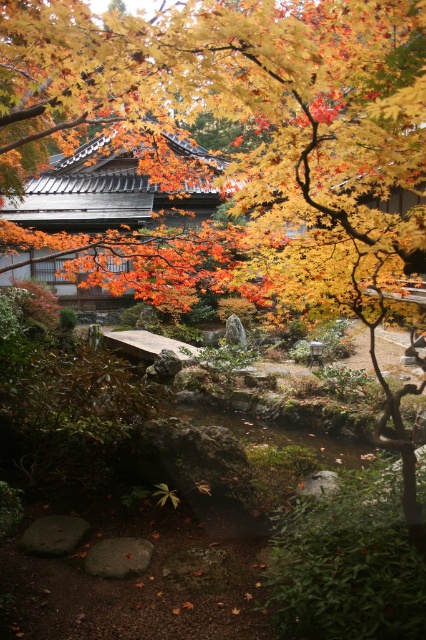
You are planning to take a photo of the golden textured leaves at upper center and the smooth stone bridge at center in the Japanese garden. Which object should you focus on first if you want to capture both in a single frame without moving the camera?

The golden textured leaves at upper center should be focused on first because they are larger in size than the smooth stone bridge at center, ensuring they are prominently visible while still fitting the smaller bridge into the frame.

What is the 2D coordinate of the golden textured leaves at upper center in the image?

The golden textured leaves at upper center are located at the 2D coordinate point of (236, 136).

You are a painter planning to sketch the golden textured leaves at upper center and the smooth stone bridge at center in the Japanese garden. Which object should you focus on first if you want to capture the wider element in your painting?

The golden textured leaves at upper center should be focused on first since their width is greater than that of the smooth stone bridge at center, making them the wider element to capture.